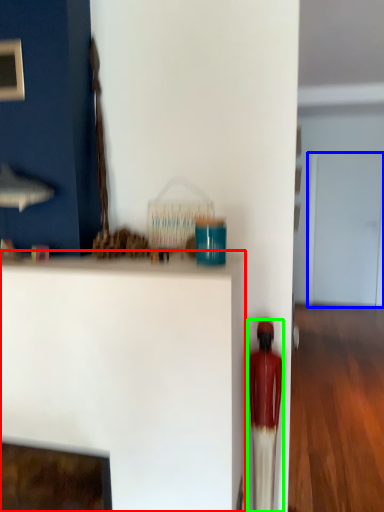
Question: Which is farther away from furniture (highlighted by a red box)? glass door (highlighted by a blue box) or toy (highlighted by a green box)?

Choices:
 (A) glass door
 (B) toy

Answer: (A)